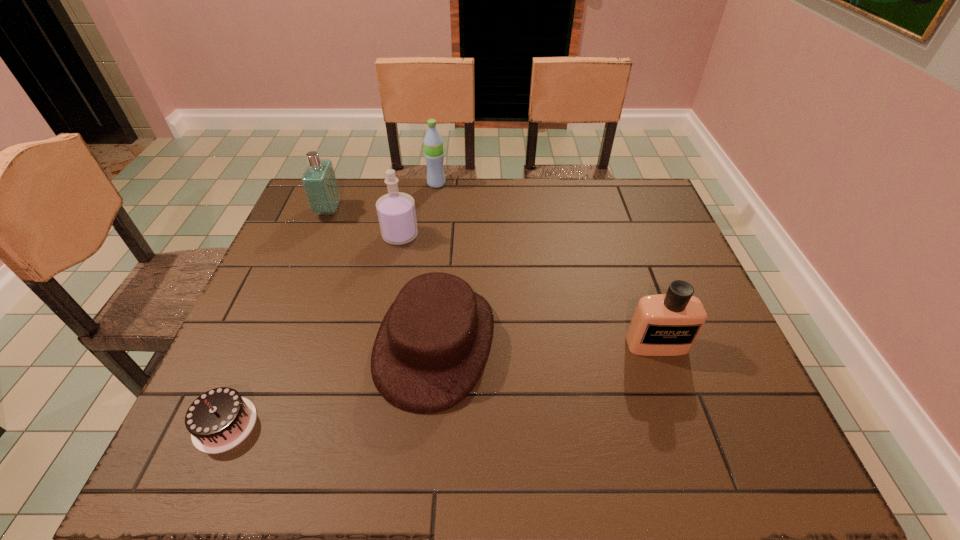
What are the coordinates of `object located in the right edge section of the desktop` in the screenshot? It's located at (668, 324).

Identify the location of object that is at the far left corner. The height and width of the screenshot is (540, 960). (319, 182).

Locate an element on the screen. This screenshot has height=540, width=960. object that is at the near left corner is located at coordinates (218, 420).

Where is `vacant region at the near edge`? vacant region at the near edge is located at coordinates (325, 451).

I want to click on free space at the left edge of the desktop, so click(276, 326).

Locate an element on the screen. vacant position at the right edge of the desktop is located at coordinates (670, 237).

The width and height of the screenshot is (960, 540). I want to click on vacant space at the far right corner of the desktop, so click(620, 213).

You are a GUI agent. You are given a task and a screenshot of the screen. Output one action in this format:
    pyautogui.click(x=<x>, y=<y>)
    Task: Click on the vacant area at the near right corner of the desktop
    Image resolution: width=960 pixels, height=540 pixels.
    Given the screenshot: What is the action you would take?
    pyautogui.click(x=780, y=463)

Find the location of `free space between the farthest object and the fourth nearest object`. free space between the farthest object and the fourth nearest object is located at coordinates (419, 210).

Find the location of a particular element. vacant space in between the second perfume from right to left and the farthest perfume is located at coordinates click(x=365, y=223).